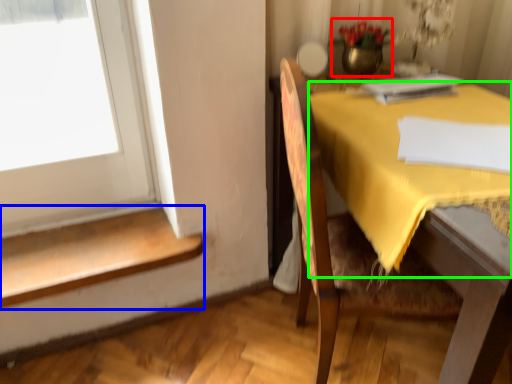
Question: Which object is the farthest from floral arrangement (highlighted by a red box)? Choose among these: stairwell (highlighted by a blue box) or tablecloth (highlighted by a green box).

Choices:
 (A) stairwell
 (B) tablecloth

Answer: (A)